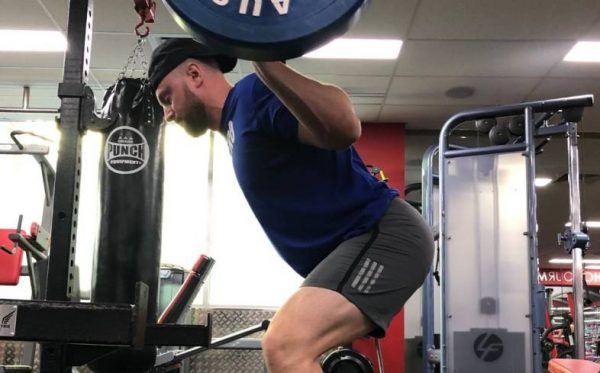
At what (x,y) coordinates should I click in order to perform the action: click on drop ceiling. Please return your answer as a coordinate pair (x, y). Looking at the image, I should click on tap(465, 44).